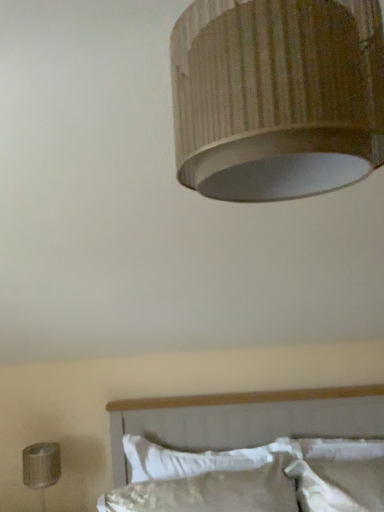
Measure the distance between white textured bed at lower center and camera.

The depth of white textured bed at lower center is 6.11 feet.

Find the location of a particular element. Image resolution: width=384 pixels, height=512 pixels. wooden textured lampshade at upper center, the first lamp viewed from the front is located at coordinates [x=277, y=96].

Describe the element at coordinates (41, 467) in the screenshot. This screenshot has width=384, height=512. I see `metallic silver lamp at lower left, placed as the 2th lamp when sorted from right to left` at that location.

What is the approximate width of white soft pillow at lower center?

14.03 centimeters.

What are the coordinates of `white textured bed at lower center` in the screenshot? It's located at (245, 419).

Which object is thinner, white textured bed at lower center or metallic silver lamp at lower left, the first lamp in the bottom-to-top sequence?

metallic silver lamp at lower left, the first lamp in the bottom-to-top sequence, is thinner.

Based on the photo, from the image's perspective, between white textured bed at lower center and metallic silver lamp at lower left, arranged as the first lamp when viewed from the back, who is located below?

metallic silver lamp at lower left, arranged as the first lamp when viewed from the back, is shown below in the image.

Is white textured bed at lower center in front of or behind metallic silver lamp at lower left, arranged as the first lamp when viewed from the back, in the image?

In the image, white textured bed at lower center appears in front of metallic silver lamp at lower left, arranged as the first lamp when viewed from the back.

Looking at this image, is white textured bed at lower center not close to metallic silver lamp at lower left, placed as the 2th lamp when sorted from right to left?

They are positioned close to each other.

Would you say wooden textured lampshade at upper center, the first lamp viewed from the front, is inside or outside white soft pillow at lower center?

wooden textured lampshade at upper center, the first lamp viewed from the front, is not inside white soft pillow at lower center, it's outside.

Between wooden textured lampshade at upper center, the 1th lamp positioned from the top, and white soft pillow at lower center, which one has more height?

wooden textured lampshade at upper center, the 1th lamp positioned from the top.

How different are the orientations of wooden textured lampshade at upper center, positioned as the second lamp in bottom-to-top order, and white soft pillow at lower center in degrees?

The angular difference between wooden textured lampshade at upper center, positioned as the second lamp in bottom-to-top order, and white soft pillow at lower center is 4.15 degrees.

Between white textured bed at lower center and wooden textured lampshade at upper center, the 1th lamp positioned from the top, which one has smaller size?

With smaller size is wooden textured lampshade at upper center, the 1th lamp positioned from the top.

You are a GUI agent. You are given a task and a screenshot of the screen. Output one action in this format:
    pyautogui.click(x=<x>, y=<y>)
    Task: Click on the lamp to the right of white textured bed at lower center
    The image size is (384, 512).
    Given the screenshot: What is the action you would take?
    [277, 96]

Does white textured bed at lower center lie behind wooden textured lampshade at upper center, positioned as the second lamp in bottom-to-top order?

Yes, it is behind wooden textured lampshade at upper center, positioned as the second lamp in bottom-to-top order.

Does white textured bed at lower center have a greater width compared to wooden textured lampshade at upper center, the 1th lamp positioned from the top?

Yes, white textured bed at lower center is wider than wooden textured lampshade at upper center, the 1th lamp positioned from the top.

From the image's perspective, is white soft pillow at lower center located beneath metallic silver lamp at lower left, the second lamp in the top-to-bottom sequence?

No, from the image's perspective, white soft pillow at lower center is not beneath metallic silver lamp at lower left, the second lamp in the top-to-bottom sequence.

Can you confirm if white soft pillow at lower center is wider than metallic silver lamp at lower left, arranged as the first lamp when viewed from the back?

Incorrect, the width of white soft pillow at lower center does not surpass that of metallic silver lamp at lower left, arranged as the first lamp when viewed from the back.

Is point (199, 452) closer or farther from the camera than point (58, 455)?

Clearly, point (199, 452) is closer to the camera than point (58, 455).

Is metallic silver lamp at lower left, the 2th lamp in the front-to-back sequence, completely or partially inside white soft pillow at lower center?

Definitely not — metallic silver lamp at lower left, the 2th lamp in the front-to-back sequence, is not inside white soft pillow at lower center.

Considering the positions of points (40, 457) and (309, 410), is point (40, 457) farther from camera compared to point (309, 410)?

No.

From a real-world perspective, between metallic silver lamp at lower left, placed as the 2th lamp when sorted from right to left, and white textured bed at lower center, who is vertically lower?

From a 3D spatial view, metallic silver lamp at lower left, placed as the 2th lamp when sorted from right to left, is below.

Is metallic silver lamp at lower left, the first lamp in the bottom-to-top sequence, completely or partially outside of white textured bed at lower center?

That's correct, metallic silver lamp at lower left, the first lamp in the bottom-to-top sequence, is outside of white textured bed at lower center.

Based on the photo, is metallic silver lamp at lower left, the first lamp in the bottom-to-top sequence, at the right side of white textured bed at lower center?

Incorrect, metallic silver lamp at lower left, the first lamp in the bottom-to-top sequence, is not on the right side of white textured bed at lower center.

From the image's perspective, is white soft pillow at lower center on wooden textured lampshade at upper center, the 2th lamp from the back?

Incorrect, from the image's perspective, white soft pillow at lower center is lower than wooden textured lampshade at upper center, the 2th lamp from the back.

Is white soft pillow at lower center completely or partially outside of wooden textured lampshade at upper center, positioned as the second lamp in bottom-to-top order?

That's correct, white soft pillow at lower center is outside of wooden textured lampshade at upper center, positioned as the second lamp in bottom-to-top order.

The height and width of the screenshot is (512, 384). What are the coordinates of `lamp located on the right of white soft pillow at lower center` in the screenshot? It's located at (277, 96).

Considering the sizes of objects white soft pillow at lower center and wooden textured lampshade at upper center, acting as the 2th lamp starting from the left, in the image provided, who is shorter, white soft pillow at lower center or wooden textured lampshade at upper center, acting as the 2th lamp starting from the left,?

white soft pillow at lower center.

From a real-world perspective, is white textured bed at lower center positioned above or below white soft pillow at lower center?

In terms of real-world spatial position, white textured bed at lower center is above white soft pillow at lower center.

Does point (118, 465) come behind point (297, 449)?

Yes, it is behind point (297, 449).

Is the position of white textured bed at lower center less distant than that of white soft pillow at lower center?

Yes, the depth of white textured bed at lower center is less than that of white soft pillow at lower center.

What's the angular difference between white textured bed at lower center and white soft pillow at lower center's facing directions?

The angular difference between white textured bed at lower center and white soft pillow at lower center is 2.28 degrees.

Find the location of a particular element. lamp below the white textured bed at lower center (from the image's perspective) is located at coordinates (41, 467).

The image size is (384, 512). Identify the location of pillow on the left of wooden textured lampshade at upper center, acting as the 2th lamp starting from the left. (197, 459).

Estimate the real-world distances between objects in this image. Which object is closer to metallic silver lamp at lower left, arranged as the first lamp when viewed from the back, white soft pillow at lower center or white textured bed at lower center?

Based on the image, white soft pillow at lower center appears to be nearer to metallic silver lamp at lower left, arranged as the first lamp when viewed from the back.

Estimate the real-world distances between objects in this image. Which object is further from white soft pillow at lower center, metallic silver lamp at lower left, the 2th lamp in the front-to-back sequence, or wooden textured lampshade at upper center, the 1th lamp positioned from the top?

Based on the image, wooden textured lampshade at upper center, the 1th lamp positioned from the top, appears to be further to white soft pillow at lower center.

When comparing their distances from wooden textured lampshade at upper center, acting as the 2th lamp starting from the left, does white soft pillow at lower center or white textured bed at lower center seem further?

Based on the image, white textured bed at lower center appears to be further to wooden textured lampshade at upper center, acting as the 2th lamp starting from the left.

Which object lies further to the anchor point white soft pillow at lower center, metallic silver lamp at lower left, placed as the 2th lamp when sorted from right to left, or white textured bed at lower center?

metallic silver lamp at lower left, placed as the 2th lamp when sorted from right to left, is further to white soft pillow at lower center.

Looking at the image, which one is located further to white soft pillow at lower center, white textured bed at lower center or metallic silver lamp at lower left, arranged as the first lamp when viewed from the back?

metallic silver lamp at lower left, arranged as the first lamp when viewed from the back.

Based on their spatial positions, is white textured bed at lower center or white soft pillow at lower center further from metallic silver lamp at lower left, the first lamp in the bottom-to-top sequence?

white textured bed at lower center is positioned further to the anchor metallic silver lamp at lower left, the first lamp in the bottom-to-top sequence.

When comparing their distances from wooden textured lampshade at upper center, the 1th lamp positioned from the top, does white textured bed at lower center or white soft pillow at lower center seem further?

white textured bed at lower center lies further to wooden textured lampshade at upper center, the 1th lamp positioned from the top, than the other object.

Based on their spatial positions, is white textured bed at lower center or wooden textured lampshade at upper center, the first lamp viewed from the front, further from white soft pillow at lower center?

wooden textured lampshade at upper center, the first lamp viewed from the front, is positioned further to the anchor white soft pillow at lower center.

You are a GUI agent. You are given a task and a screenshot of the screen. Output one action in this format:
    pyautogui.click(x=<x>, y=<y>)
    Task: Click on the bed situated between metallic silver lamp at lower left, the 2th lamp in the front-to-back sequence, and white soft pillow at lower center from left to right
    
    Given the screenshot: What is the action you would take?
    pyautogui.click(x=245, y=419)

Locate an element on the screen. Image resolution: width=384 pixels, height=512 pixels. bed between wooden textured lampshade at upper center, the 1th lamp positioned from the top, and white soft pillow at lower center in the front-back direction is located at coordinates (245, 419).

At what (x,y) coordinates should I click in order to perform the action: click on bed positioned between wooden textured lampshade at upper center, acting as the 2th lamp starting from the left, and metallic silver lamp at lower left, the first lamp positioned from the left, from near to far. Please return your answer as a coordinate pair (x, y). The image size is (384, 512). Looking at the image, I should click on (245, 419).

The image size is (384, 512). I want to click on lamp between wooden textured lampshade at upper center, acting as the 2th lamp starting from the left, and white soft pillow at lower center, along the z-axis, so click(41, 467).